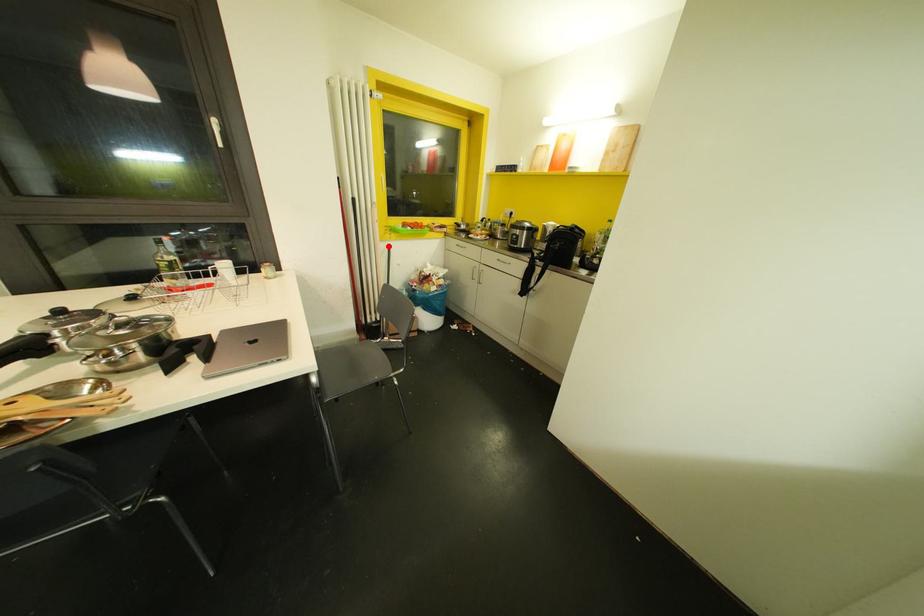
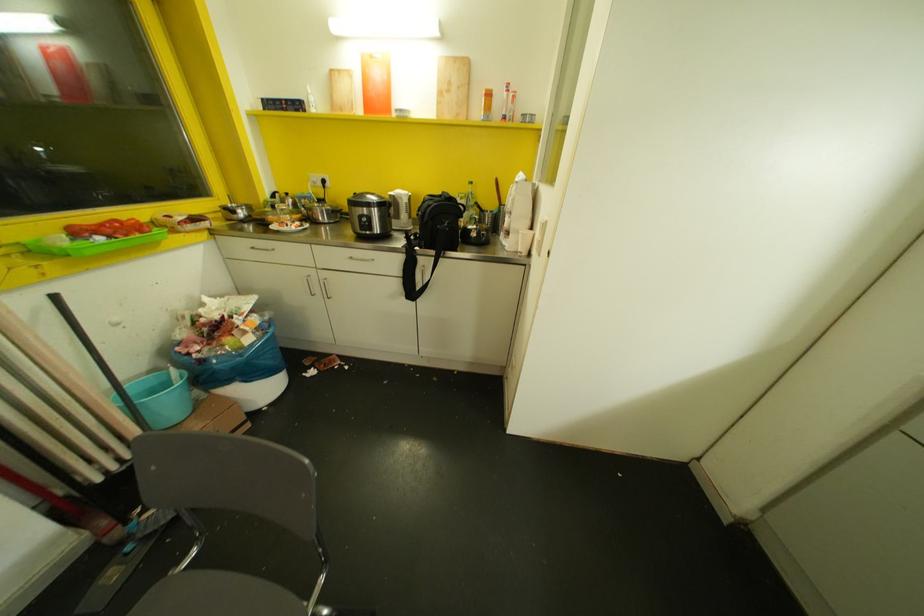
Where in the second image is the point corresponding to the highlighted location from the first image?

(55, 296)